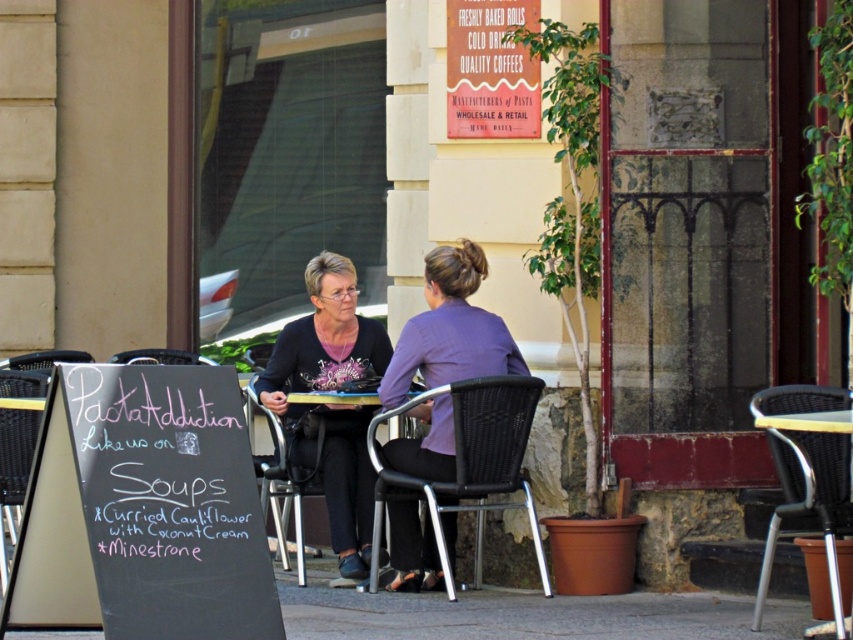
Which is below, black chalkboard sign at lower left or matte black sweater at center?

Positioned lower is black chalkboard sign at lower left.

Does point (160, 477) lie in front of point (329, 333)?

Yes, it is.

Describe the element at coordinates (170, 502) in the screenshot. I see `black chalkboard sign at lower left` at that location.

You are a GUI agent. You are given a task and a screenshot of the screen. Output one action in this format:
    pyautogui.click(x=<x>, y=<y>)
    Task: Click on the black chalkboard sign at lower left
    Image resolution: width=853 pixels, height=640 pixels.
    Given the screenshot: What is the action you would take?
    pyautogui.click(x=170, y=502)

Does yellow wicker chair at right have a smaller size compared to black plastic chair at left?

Actually, yellow wicker chair at right might be larger than black plastic chair at left.

I want to click on yellow wicker chair at right, so click(810, 500).

Identify the location of yellow wicker chair at right. (810, 500).

This screenshot has height=640, width=853. Describe the element at coordinates (170, 502) in the screenshot. I see `black chalkboard sign at lower left` at that location.

In order to click on black chalkboard sign at lower left in this screenshot , I will do `click(170, 502)`.

Does point (277, 602) come in front of point (166, 353)?

Yes, point (277, 602) is closer to viewer.

Image resolution: width=853 pixels, height=640 pixels. I want to click on black chalkboard sign at lower left, so coord(170,502).